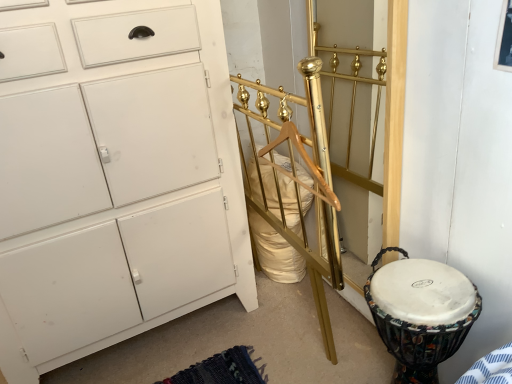
Question: Considering the positions of gold polished metal bed frame at center and white matte cabinet at left in the image, is gold polished metal bed frame at center bigger or smaller than white matte cabinet at left?

Choices:
 (A) small
 (B) big

Answer: (A)

Question: Does point (330, 228) appear closer or farther from the camera than point (10, 3)?

Choices:
 (A) closer
 (B) farther

Answer: (B)

Question: Which object is the farthest from the gold polished metal bed frame at center?

Choices:
 (A) white fabric-covered drum at lower right
 (B) white matte cabinet at left

Answer: (B)

Question: Which object is the farthest from the white fabric-covered drum at lower right?

Choices:
 (A) gold polished metal bed frame at center
 (B) white matte cabinet at left

Answer: (B)